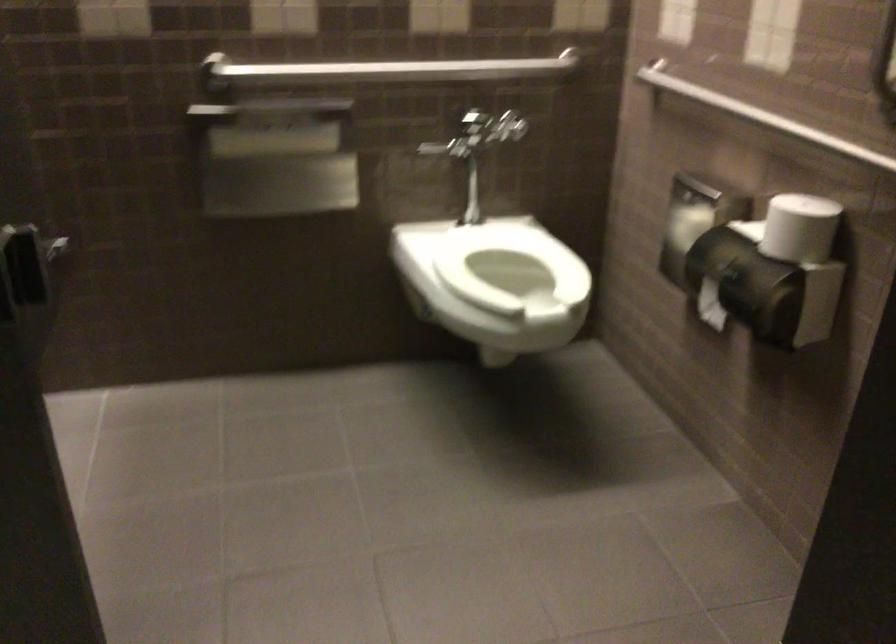
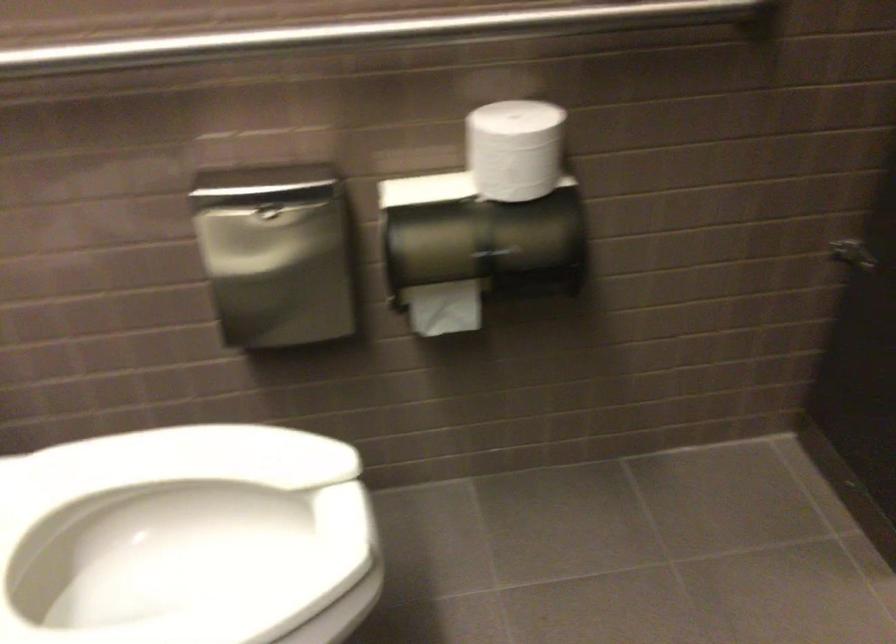
Where in the second image is the point corresponding to point (753, 111) from the first image?

(368, 33)